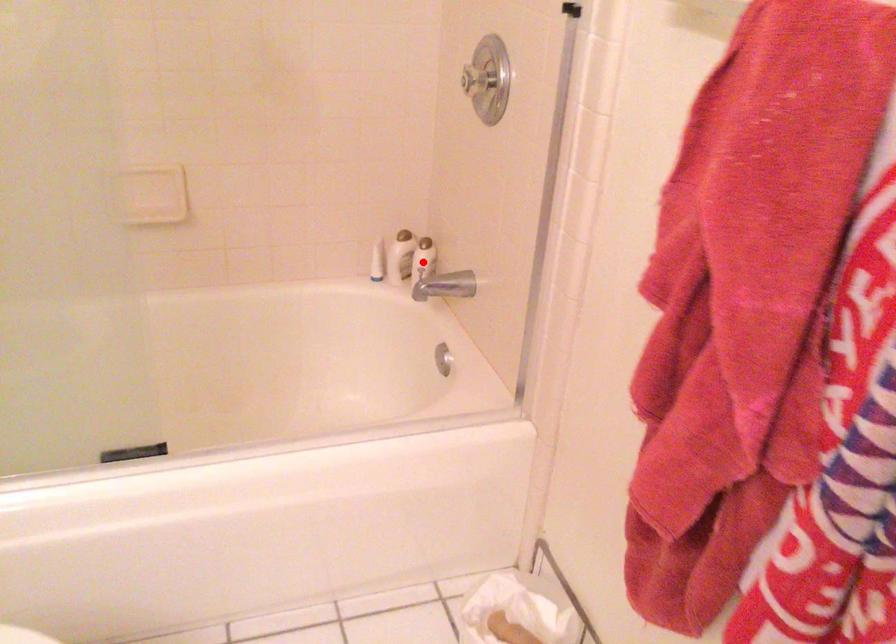
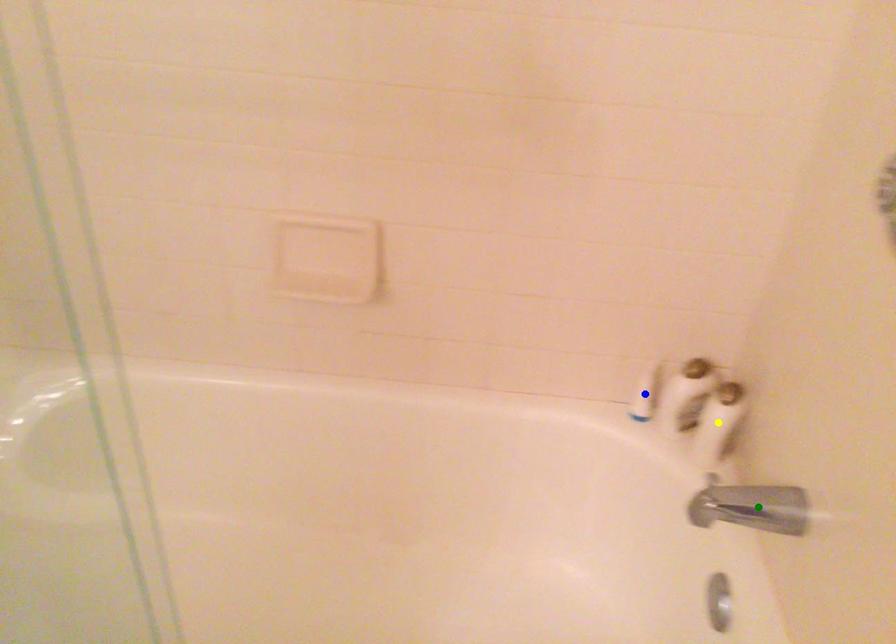
Question: I am providing you with two images of the same scene from different viewpoints. A red point is marked on the first image. You are given multiple points on the second image. Which spot in image 2 lines up with the point in image 1?

Choices:
 (A) blue point
 (B) yellow point
 (C) green point

Answer: (B)